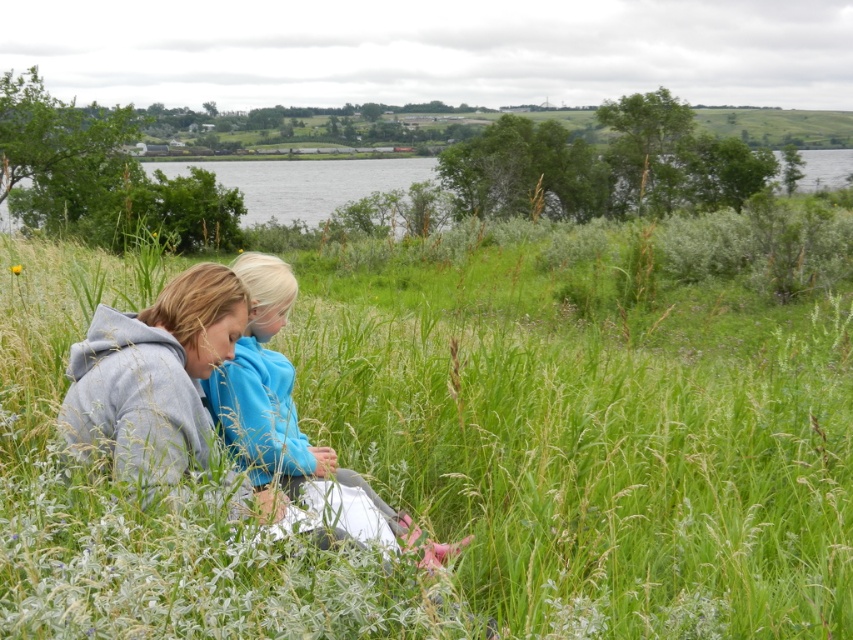
Question: Is green grass at center positioned at the back of blue fleece jacket at lower left?

Choices:
 (A) no
 (B) yes

Answer: (A)

Question: Does green grass at center have a smaller size compared to yellow matte flower at center?

Choices:
 (A) yes
 (B) no

Answer: (B)

Question: Which is farther from the blue fleece jacket at lower left?

Choices:
 (A) yellow matte flower at center
 (B) green grass at center

Answer: (B)

Question: Which of the following is the farthest from the observer?

Choices:
 (A) (665, 381)
 (B) (12, 266)

Answer: (B)

Question: Based on their relative distances, which object is nearer to the blue fleece jacket at lower left?

Choices:
 (A) green grass at center
 (B) yellow matte flower at center

Answer: (B)

Question: Considering the relative positions of green grass at center and yellow matte flower at center in the image provided, where is green grass at center located with respect to yellow matte flower at center?

Choices:
 (A) right
 (B) left

Answer: (A)